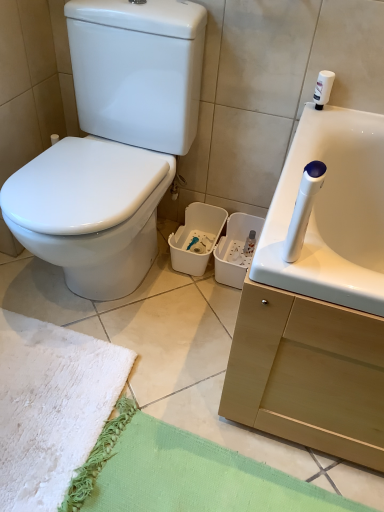
Question: In terms of size, does white fluffy beach towel at lower left appear bigger or smaller than white glossy toilet at left?

Choices:
 (A) small
 (B) big

Answer: (A)

Question: Would you say white fluffy beach towel at lower left is inside or outside white glossy toilet at left?

Choices:
 (A) inside
 (B) outside

Answer: (B)

Question: In terms of width, does white fluffy beach towel at lower left look wider or thinner when compared to white glossy toilet at left?

Choices:
 (A) wide
 (B) thin

Answer: (B)

Question: Is point (145, 137) closer or farther from the camera than point (99, 355)?

Choices:
 (A) closer
 (B) farther

Answer: (B)

Question: Would you say white glossy toilet at left is to the left or to the right of white fluffy beach towel at lower left in the picture?

Choices:
 (A) right
 (B) left

Answer: (A)

Question: Relative to white fluffy beach towel at lower left, is white glossy toilet at left in front or behind?

Choices:
 (A) front
 (B) behind

Answer: (A)

Question: From the image's perspective, is white glossy toilet at left located above or below white fluffy beach towel at lower left?

Choices:
 (A) below
 (B) above

Answer: (B)